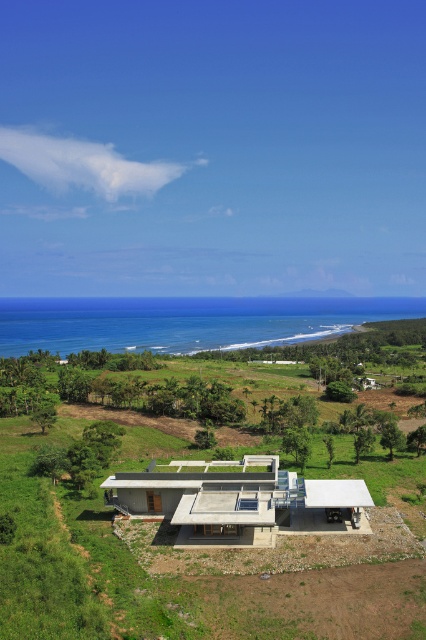
Question: Does blue ocean at lower center appear over concrete house at center?

Choices:
 (A) no
 (B) yes

Answer: (B)

Question: Is blue ocean at lower center to the left of concrete house at center from the viewer's perspective?

Choices:
 (A) no
 (B) yes

Answer: (B)

Question: Does blue ocean at lower center have a greater width compared to concrete house at center?

Choices:
 (A) no
 (B) yes

Answer: (B)